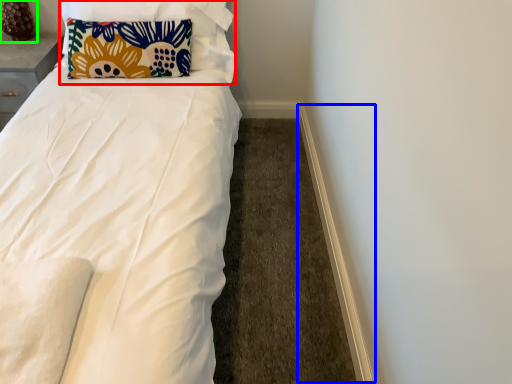
Question: Which object is positioned closest to pillow (highlighted by a red box)? Select from trim (highlighted by a blue box) and table lamp (highlighted by a green box).

Choices:
 (A) trim
 (B) table lamp

Answer: (B)